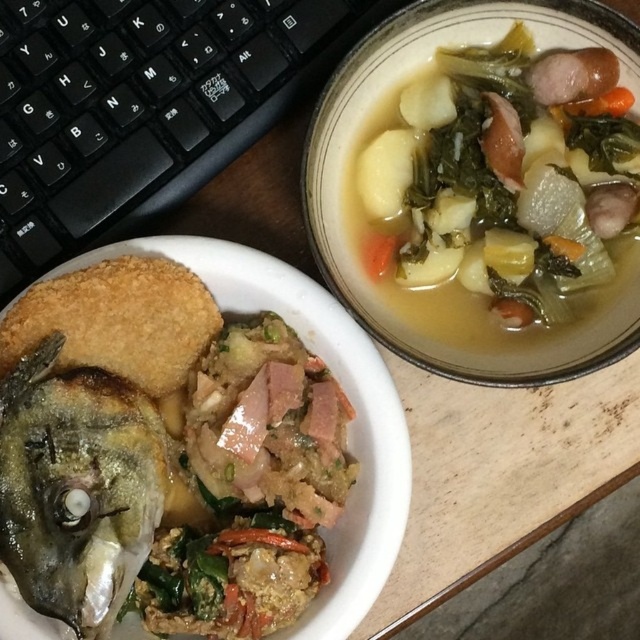
Is green leafy vegetable at upper right thinner than shiny silver fish head at lower left?

Incorrect, green leafy vegetable at upper right's width is not less than shiny silver fish head at lower left's.

Is green leafy vegetable at upper right shorter than shiny silver fish head at lower left?

Incorrect, green leafy vegetable at upper right's height does not fall short of shiny silver fish head at lower left's.

Does point (563, 218) lie in front of point (104, 449)?

That is False.

Where is `green leafy vegetable at upper right`? The width and height of the screenshot is (640, 640). green leafy vegetable at upper right is located at coordinates (500, 177).

Is green leafy vegetable at upper right behind white matte bowl at center?

That is True.

Is green leafy vegetable at upper right thinner than white matte bowl at center?

Yes, green leafy vegetable at upper right is thinner than white matte bowl at center.

Is point (387, 200) positioned in front of point (140, 243)?

No, it is behind (140, 243).

Identify the location of green leafy vegetable at upper right. The height and width of the screenshot is (640, 640). (500, 177).

Does point (109, 561) lie in front of point (337, 522)?

Yes.

Can you confirm if shiny silver fish head at lower left is bigger than white matte bowl at center?

Actually, shiny silver fish head at lower left might be smaller than white matte bowl at center.

This screenshot has height=640, width=640. What do you see at coordinates (76, 486) in the screenshot? I see `shiny silver fish head at lower left` at bounding box center [76, 486].

This screenshot has width=640, height=640. I want to click on shiny silver fish head at lower left, so pos(76,486).